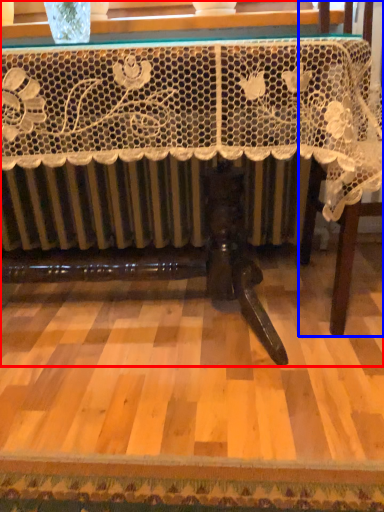
Question: Which object is further to the camera taking this photo, table (highlighted by a red box) or furniture (highlighted by a blue box)?

Choices:
 (A) table
 (B) furniture

Answer: (B)